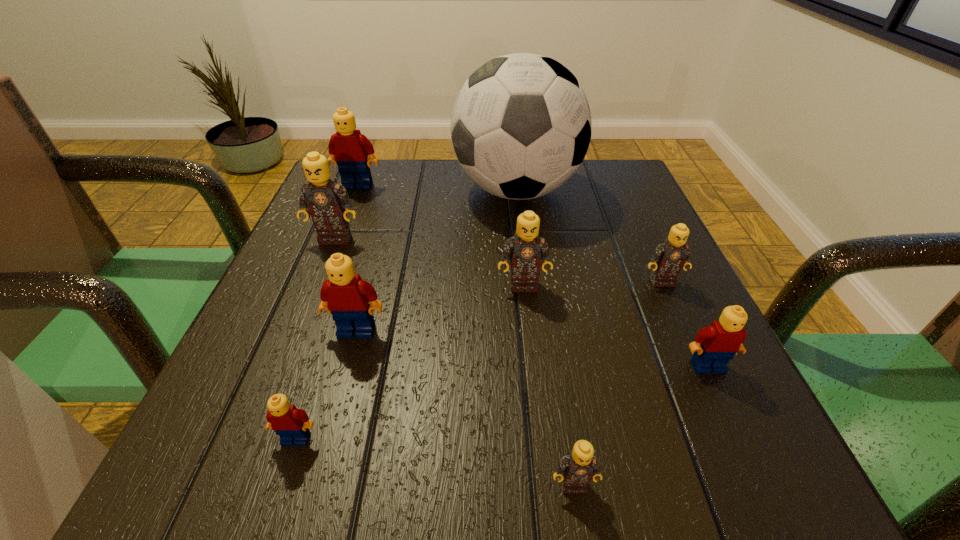
Locate an element on the screen. This screenshot has width=960, height=540. black soccer ball is located at coordinates (521, 126).

Identify the location of the tallest object. The height and width of the screenshot is (540, 960). (521, 126).

Where is `the biggest yellow Lego`? Image resolution: width=960 pixels, height=540 pixels. the biggest yellow Lego is located at coordinates (349, 149).

Locate an element on the screen. The height and width of the screenshot is (540, 960). the farthest Lego is located at coordinates (349, 149).

The height and width of the screenshot is (540, 960). In order to click on the third farthest object in this screenshot , I will do `click(327, 201)`.

Identify the location of the seventh nearest Lego. (327, 201).

You are a GUI agent. You are given a task and a screenshot of the screen. Output one action in this format:
    pyautogui.click(x=<x>, y=<y>)
    Task: Click on the third smallest tan Lego
    
    Given the screenshot: What is the action you would take?
    pyautogui.click(x=525, y=250)

The width and height of the screenshot is (960, 540). Find the location of `the fourth nearest object`. the fourth nearest object is located at coordinates (345, 295).

Locate an element on the screen. This screenshot has height=540, width=960. the second farthest yellow Lego is located at coordinates (345, 295).

Where is `the second smallest tan Lego`? This screenshot has width=960, height=540. the second smallest tan Lego is located at coordinates (671, 256).